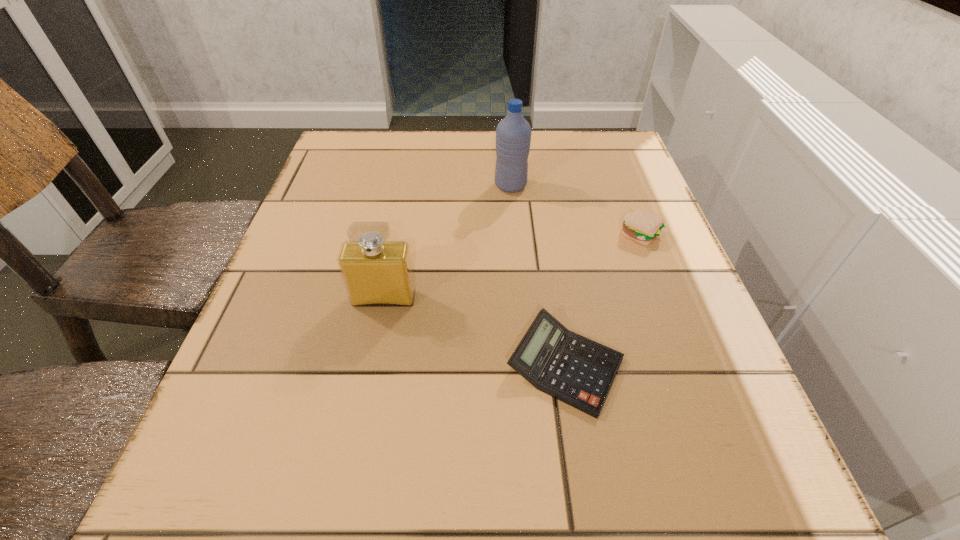
At what (x,y) coordinates should I click in order to perform the action: click on vacant point located 0.170m on the left of the nearest object. Please return your answer as a coordinate pair (x, y). Looking at the image, I should click on (396, 366).

Identify the location of object that is at the far edge. The image size is (960, 540). (513, 133).

At what (x,y) coordinates should I click in order to perform the action: click on object located in the left edge section of the desktop. Please return your answer as a coordinate pair (x, y). The width and height of the screenshot is (960, 540). Looking at the image, I should click on (376, 273).

Identify the location of patty that is at the right edge. (643, 227).

Image resolution: width=960 pixels, height=540 pixels. I want to click on calculator that is positioned at the right edge, so click(578, 371).

Where is `free space at the far edge of the desktop`? free space at the far edge of the desktop is located at coordinates (x=564, y=153).

Where is `free space at the near edge of the desktop`? free space at the near edge of the desktop is located at coordinates [x=649, y=489].

Where is `vacant space at the left edge of the desktop`? The width and height of the screenshot is (960, 540). vacant space at the left edge of the desktop is located at coordinates (352, 194).

This screenshot has height=540, width=960. I want to click on free space at the right edge, so click(x=613, y=265).

In the image, there is a desktop. Find the location of `vacant space at the far left corner`. vacant space at the far left corner is located at coordinates (387, 136).